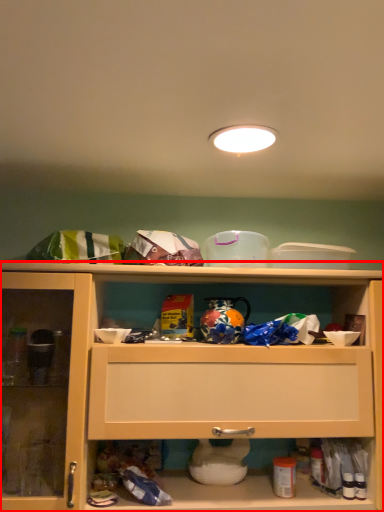
Question: From the image's perspective, where is cabinetry (annotated by the red box) located relative to lighting?

Choices:
 (A) below
 (B) above

Answer: (A)